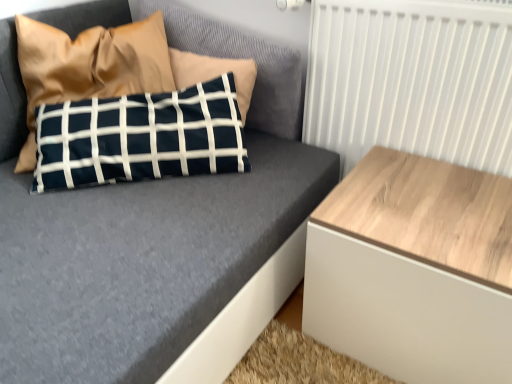
You are a GUI agent. You are given a task and a screenshot of the screen. Output one action in this format:
    pyautogui.click(x=<x>, y=<y>)
    Task: Click on the white wood radiator at upper right
    The image size is (512, 384).
    Given the screenshot: What is the action you would take?
    pyautogui.click(x=411, y=80)

You are a GUI agent. You are given a task and a screenshot of the screen. Output one action in this format:
    pyautogui.click(x=<x>, y=<y>)
    Task: Click on the light wood/texture side table at right
    Image resolution: width=512 pixels, height=384 pixels.
    Given the screenshot: What is the action you would take?
    pyautogui.click(x=414, y=270)

The height and width of the screenshot is (384, 512). Identify the location of white wood radiator at upper right. (411, 80).

Does navy blue fabric pillow at upper left have a greater width compared to white wood radiator at upper right?

Yes.

Considering the points (33, 131) and (377, 62), which point is behind, point (33, 131) or point (377, 62)?

The point (33, 131) is farther.

From a real-world perspective, is navy blue fabric pillow at upper left located higher than white wood radiator at upper right?

Yes, from a real-world perspective, navy blue fabric pillow at upper left is over white wood radiator at upper right

Could you tell me if navy blue fabric pillow at upper left is turned towards white wood radiator at upper right?

No, navy blue fabric pillow at upper left is not turned towards white wood radiator at upper right.

From the image's perspective, is light wood/texture side table at right under white wood radiator at upper right?

Correct, light wood/texture side table at right appears lower than white wood radiator at upper right in the image.

Image resolution: width=512 pixels, height=384 pixels. Find the location of `radiator on the left of the light wood/texture side table at right`. radiator on the left of the light wood/texture side table at right is located at coordinates (411, 80).

Does light wood/texture side table at right appear on the right side of white wood radiator at upper right?

Yes, light wood/texture side table at right is to the right of white wood radiator at upper right.

Could you tell me if light wood/texture side table at right is turned towards white wood radiator at upper right?

No, light wood/texture side table at right is not facing towards white wood radiator at upper right.

This screenshot has width=512, height=384. What are the coordinates of `pillow that appears on the left of light wood/texture side table at right` in the screenshot? It's located at (89, 66).

From the image's perspective, is navy blue fabric pillow at upper left over light wood/texture side table at right?

Correct, navy blue fabric pillow at upper left appears higher than light wood/texture side table at right in the image.

How different are the orientations of navy blue fabric pillow at upper left and light wood/texture side table at right in degrees?

The angle between the facing direction of navy blue fabric pillow at upper left and the facing direction of light wood/texture side table at right is 49.9 degrees.

Does light wood/texture side table at right appear on the right side of navy blue fabric pillow at upper left?

Yes, light wood/texture side table at right is to the right of navy blue fabric pillow at upper left.

Is light wood/texture side table at right spatially inside navy blue fabric pillow at upper left, or outside of it?

light wood/texture side table at right is spatially situated outside navy blue fabric pillow at upper left.

Who is taller, light wood/texture side table at right or navy blue fabric pillow at upper left?

navy blue fabric pillow at upper left is taller.

From the image's perspective, does light wood/texture side table at right appear lower than navy blue fabric pillow at upper left?

Yes, from the image's perspective, light wood/texture side table at right is beneath navy blue fabric pillow at upper left.

In the image, is white wood radiator at upper right on the left side or the right side of light wood/texture side table at right?

white wood radiator at upper right is to the left of light wood/texture side table at right.

Considering the sizes of white wood radiator at upper right and light wood/texture side table at right in the image, is white wood radiator at upper right bigger or smaller than light wood/texture side table at right?

Clearly, white wood radiator at upper right is smaller in size than light wood/texture side table at right.

Is the depth of white wood radiator at upper right greater than that of light wood/texture side table at right?

Yes, white wood radiator at upper right is behind light wood/texture side table at right.

Which is correct: white wood radiator at upper right is inside light wood/texture side table at right, or outside of it?

white wood radiator at upper right is not enclosed by light wood/texture side table at right.

Considering the positions of point (310, 99) and point (122, 29), is point (310, 99) closer or farther from the camera than point (122, 29)?

Point (310, 99) is positioned closer to the camera compared to point (122, 29).

Is white wood radiator at upper right spatially inside navy blue fabric pillow at upper left, or outside of it?

white wood radiator at upper right is outside navy blue fabric pillow at upper left.

From a real-world perspective, who is located lower, white wood radiator at upper right or navy blue fabric pillow at upper left?

white wood radiator at upper right.

Is white wood radiator at upper right oriented away from navy blue fabric pillow at upper left?

No.

Image resolution: width=512 pixels, height=384 pixels. In order to click on radiator that appears in front of the navy blue fabric pillow at upper left in this screenshot , I will do `click(411, 80)`.

Identify the location of table on the right of the white wood radiator at upper right. (414, 270).

From the image, which object appears to be nearer to navy blue fabric pillow at upper left, light wood/texture side table at right or white wood radiator at upper right?

white wood radiator at upper right is positioned closer to the anchor navy blue fabric pillow at upper left.

Which object lies further to the anchor point white wood radiator at upper right, light wood/texture side table at right or navy blue fabric pillow at upper left?

Based on the image, navy blue fabric pillow at upper left appears to be further to white wood radiator at upper right.

Consider the image. Based on their spatial positions, is navy blue fabric pillow at upper left or light wood/texture side table at right closer to white wood radiator at upper right?

Among the two, light wood/texture side table at right is located nearer to white wood radiator at upper right.

Considering their positions, is navy blue fabric pillow at upper left positioned closer to light wood/texture side table at right than white wood radiator at upper right?

The object closer to light wood/texture side table at right is white wood radiator at upper right.

Which object lies nearer to the anchor point navy blue fabric pillow at upper left, white wood radiator at upper right or light wood/texture side table at right?

The object closer to navy blue fabric pillow at upper left is white wood radiator at upper right.

Estimate the real-world distances between objects in this image. Which object is further from light wood/texture side table at right, white wood radiator at upper right or navy blue fabric pillow at upper left?

navy blue fabric pillow at upper left is further to light wood/texture side table at right.

At what (x,y) coordinates should I click in order to perform the action: click on radiator between navy blue fabric pillow at upper left and light wood/texture side table at right. Please return your answer as a coordinate pair (x, y). This screenshot has width=512, height=384. Looking at the image, I should click on (411, 80).